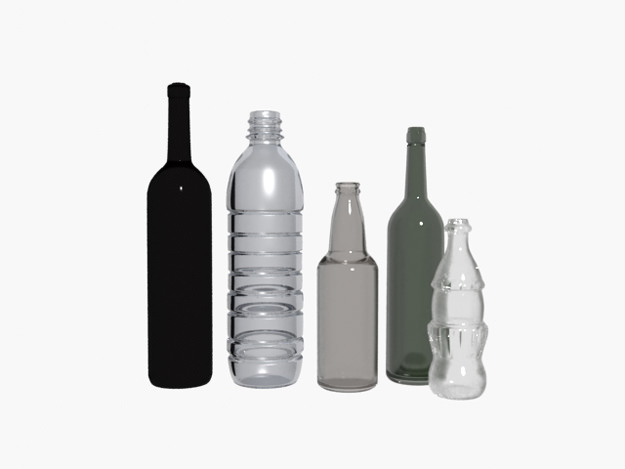
What are the coordinates of `bottle` in the screenshot? It's located at (188, 256), (252, 254), (344, 297), (419, 261), (481, 285).